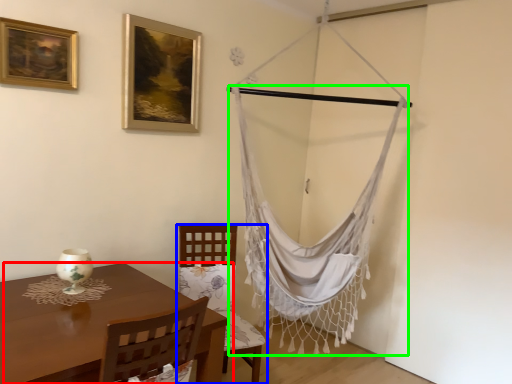
Question: Based on their relative distances, which object is farther from table (highlighted by a red box)? Choose from chair (highlighted by a blue box) and curtain (highlighted by a green box).

Choices:
 (A) chair
 (B) curtain

Answer: (B)